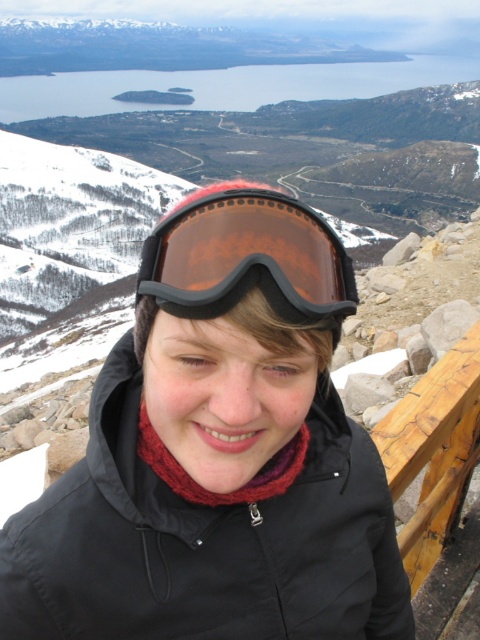
What do you see at coordinates (247, 259) in the screenshot? Image resolution: width=480 pixels, height=640 pixels. I see `transparent plastic goggles at center` at bounding box center [247, 259].

Who is lower down, transparent plastic goggles at center or black fabric jacket at center?

black fabric jacket at center is below.

In order to click on transparent plastic goggles at center in this screenshot , I will do `click(247, 259)`.